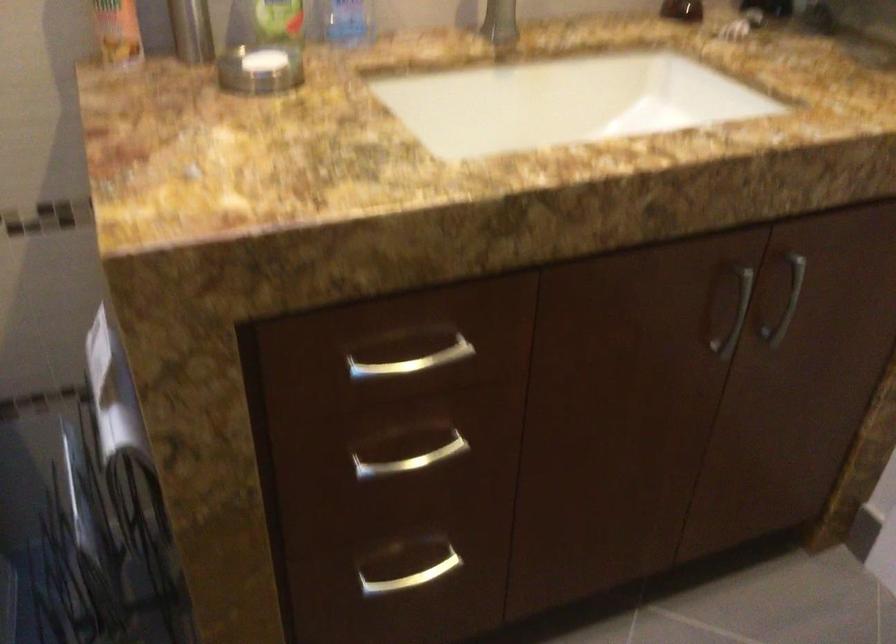
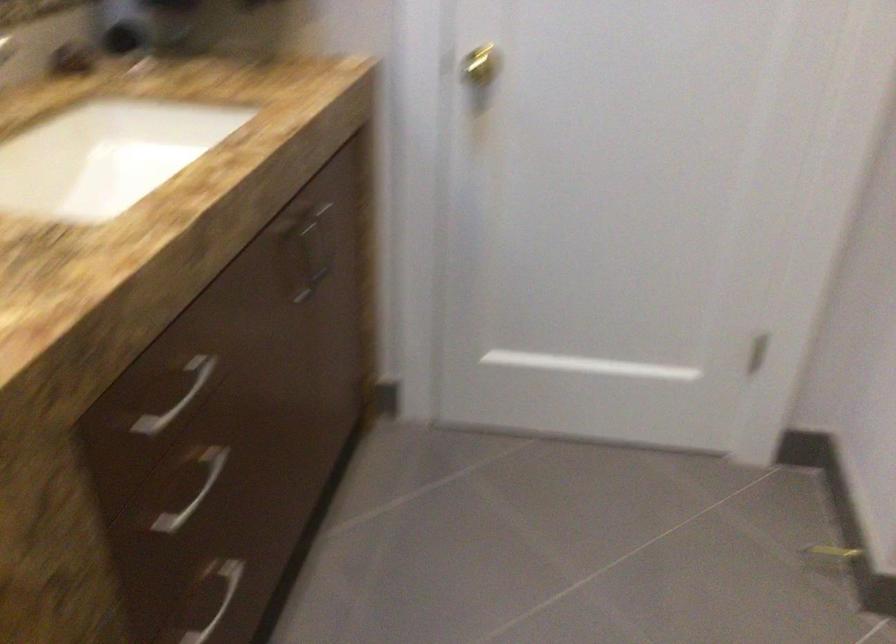
Question: The camera is either moving clockwise (left) or counter-clockwise (right) around the object. The first image is from the beginning of the video and the second image is from the end. Is the camera moving left or right when shooting the video?

Choices:
 (A) Left
 (B) Right

Answer: (A)